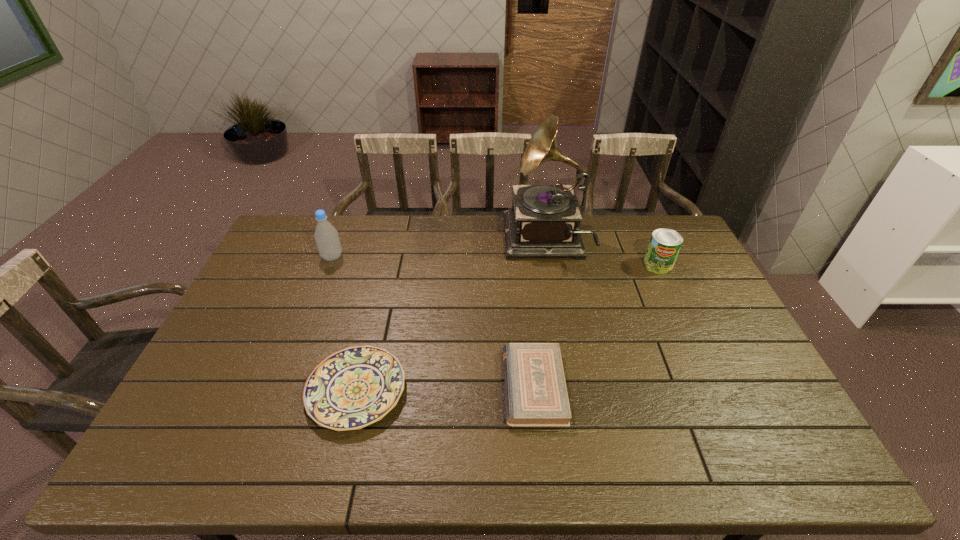
Where is `record player`? The image size is (960, 540). record player is located at coordinates (544, 220).

Find the location of a particular element. This screenshot has height=540, width=960. bottle is located at coordinates (327, 240).

Find the location of a particular element. the leftmost object is located at coordinates (327, 240).

This screenshot has width=960, height=540. In order to click on the third tallest object in this screenshot , I will do pyautogui.click(x=664, y=246).

What are the coordinates of `the rightmost object` in the screenshot? It's located at (664, 246).

Identify the location of Bible. (536, 394).

The height and width of the screenshot is (540, 960). Find the location of `the shortest object`. the shortest object is located at coordinates (355, 387).

The height and width of the screenshot is (540, 960). Identify the location of plate. (355, 387).

Image resolution: width=960 pixels, height=540 pixels. In order to click on free space located 0.380m on the horn of the tallest object in this screenshot , I will do `click(401, 241)`.

Where is `vacant position located 0.170m on the horn of the tallest object`? The image size is (960, 540). vacant position located 0.170m on the horn of the tallest object is located at coordinates (459, 241).